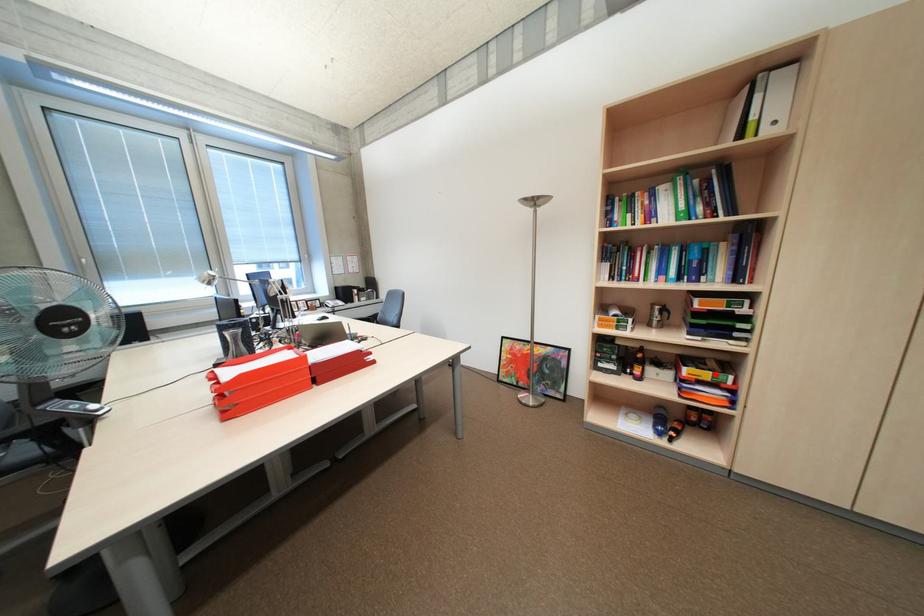
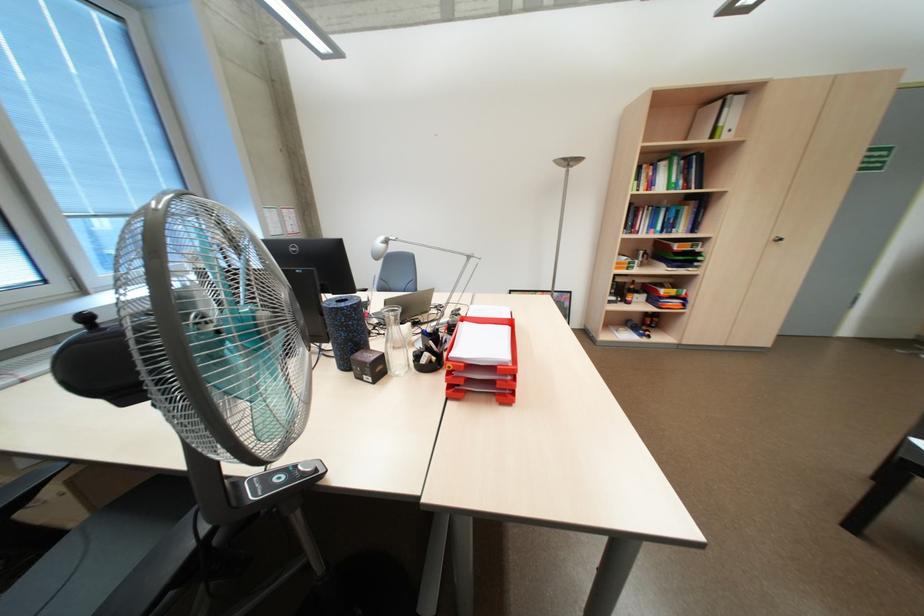
In the second image, find the point that corresponds to the highlighted location in the first image.

(683, 291)